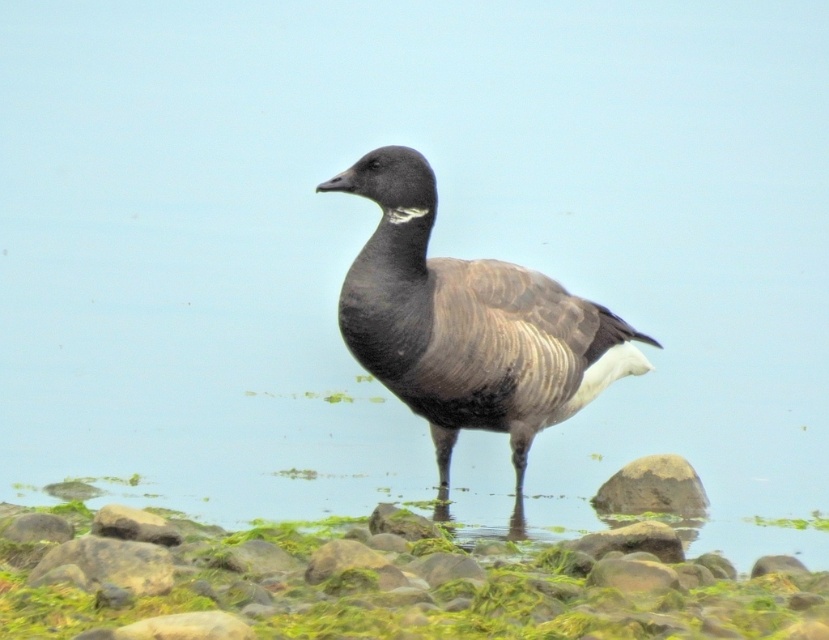
Can you confirm if green mossy rocks at lower center is positioned to the left of smooth gray rock at lower right?

Correct, you'll find green mossy rocks at lower center to the left of smooth gray rock at lower right.

Who is higher up, green mossy rocks at lower center or smooth gray rock at lower right?

smooth gray rock at lower right is higher up.

Is point (171, 596) in front of point (611, 492)?

Yes, point (171, 596) is in front of point (611, 492).

Find the location of a particular element. The height and width of the screenshot is (640, 829). green mossy rocks at lower center is located at coordinates (388, 588).

Who is more forward, (32, 552) or (574, 364)?

Point (32, 552)

Locate an element on the screen. green mossy rocks at lower center is located at coordinates (388, 588).

Image resolution: width=829 pixels, height=640 pixels. What do you see at coordinates (468, 323) in the screenshot?
I see `dark brown feathered duck at center` at bounding box center [468, 323].

Does dark brown feathered duck at center appear over smooth gray rock at lower right?

Correct, dark brown feathered duck at center is located above smooth gray rock at lower right.

Consider the image. Who is more distant from viewer, (x=327, y=188) or (x=671, y=490)?

The point (x=671, y=490) is more distant.

The width and height of the screenshot is (829, 640). In order to click on dark brown feathered duck at center in this screenshot , I will do `click(468, 323)`.